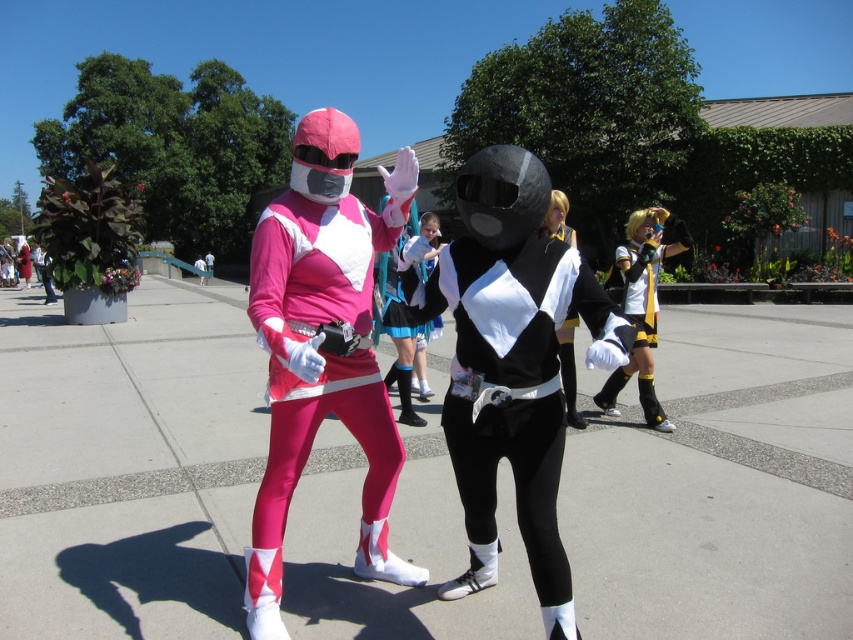
You are a photographer at a cosplay event. You want to take a photo of the matte pink costume at center and the yellow and black fabric costume at right. If your camera has a maximum focus range of 3 meters, will both characters be in focus?

The matte pink costume at center is 3.62 meters away from the yellow and black fabric costume at right. Since the distance between them exceeds the camera maximum focus range of 3 meters, the camera cannot focus on both characters simultaneously.

You are a photographer at a cosplay event and need to position a spotlight. The spotlight can only illuminate objects within a 0.5 unit radius from its center. If you place the spotlight at coordinates point A, which is at position point A, will it illuminate the matte pink costume at center?

The answer is yes because the distance between the spotlight at point A and the matte pink costume at center is within the 0.5 unit radius.